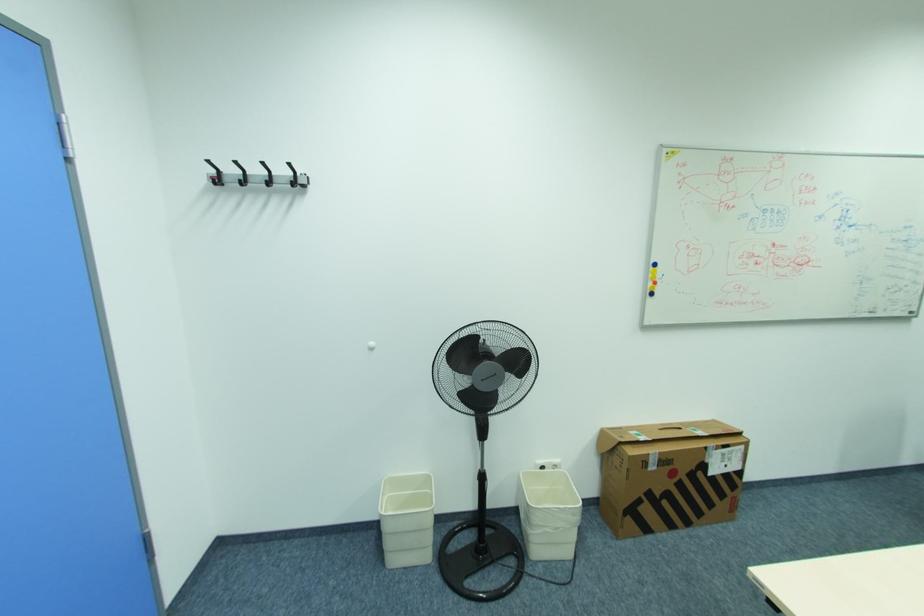
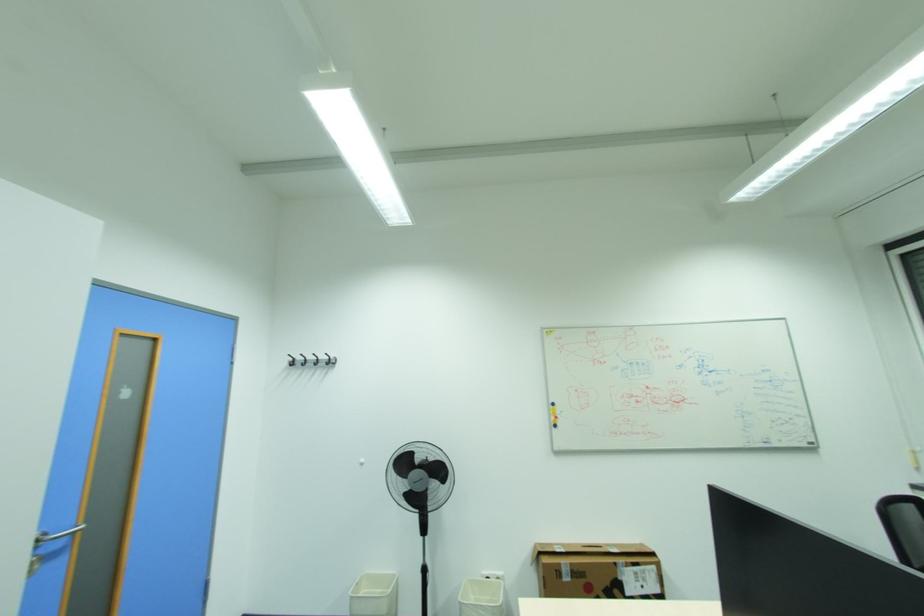
Which direction would the cameraman need to move to produce the second image?

The cameraman moved toward right, backward.